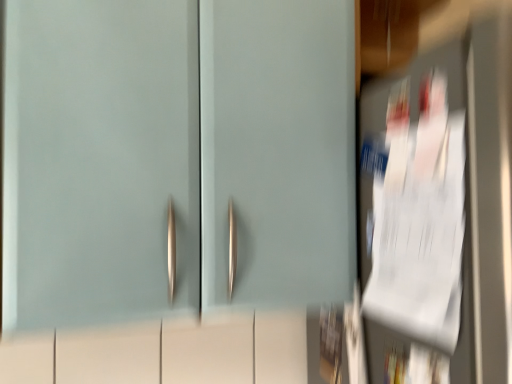
Question: From the image's perspective, is white paper at right, which is the 2th door in left-to-right order, positioned above or below matte teal cabinet at center, which ranks as the 1th door in left-to-right order?

Choices:
 (A) above
 (B) below

Answer: (B)

Question: From their relative heights in the image, would you say white paper at right, placed as the first door when sorted from right to left, is taller or shorter than matte teal cabinet at center, which ranks as the 1th door in left-to-right order?

Choices:
 (A) tall
 (B) short

Answer: (A)

Question: From a real-world perspective, is white paper at right, placed as the first door when sorted from right to left, above or below matte teal cabinet at center, marked as the 2th door in a right-to-left arrangement?

Choices:
 (A) above
 (B) below

Answer: (B)

Question: From the image's perspective, is matte teal cabinet at center, which ranks as the 1th door in left-to-right order, located above or below white paper at right, which is the 2th door in left-to-right order?

Choices:
 (A) above
 (B) below

Answer: (A)

Question: Is matte teal cabinet at center, marked as the 2th door in a right-to-left arrangement, wider or thinner than white paper at right, placed as the first door when sorted from right to left?

Choices:
 (A) thin
 (B) wide

Answer: (A)

Question: Visually, is matte teal cabinet at center, which ranks as the 1th door in left-to-right order, positioned to the left or to the right of white paper at right, placed as the first door when sorted from right to left?

Choices:
 (A) left
 (B) right

Answer: (A)

Question: Is matte teal cabinet at center, marked as the 2th door in a right-to-left arrangement, bigger or smaller than white paper at right, which is the 2th door in left-to-right order?

Choices:
 (A) small
 (B) big

Answer: (A)